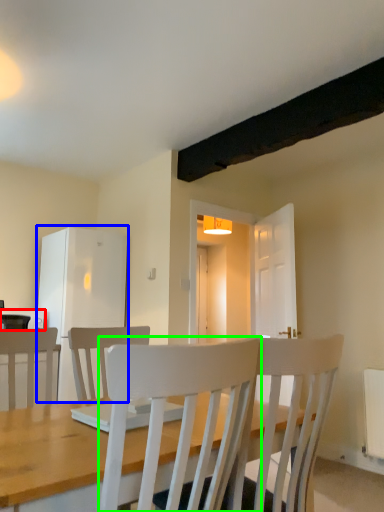
Question: Based on their relative distances, which object is farther from appliance (highlighted by a red box)? Choose from fridge (highlighted by a blue box) and chair (highlighted by a green box).

Choices:
 (A) fridge
 (B) chair

Answer: (B)